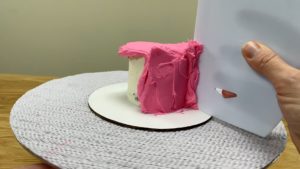
Locate an element on the screen. The width and height of the screenshot is (300, 169). taupe wall is located at coordinates [69, 40].